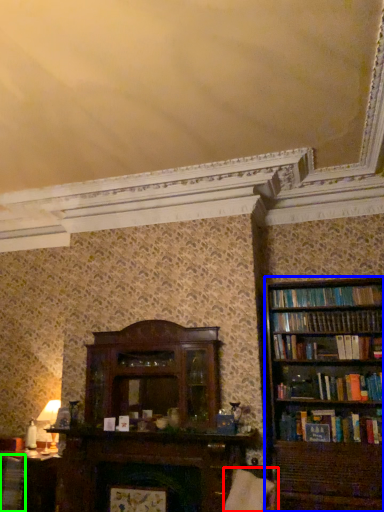
Question: Based on their relative distances, which object is nearer to swivel chair (highlighted by a red box)? Choose from bookcase (highlighted by a blue box) and book (highlighted by a green box).

Choices:
 (A) bookcase
 (B) book

Answer: (A)